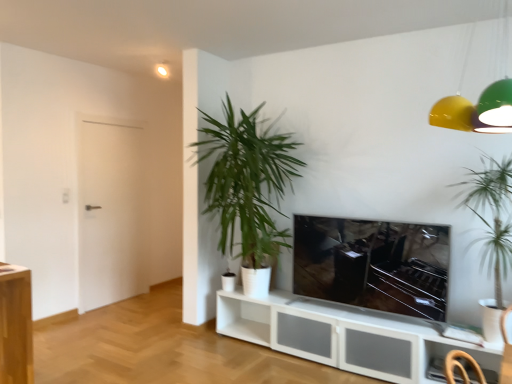
In order to click on free point to the right of white matte door at left in this screenshot , I will do `click(151, 305)`.